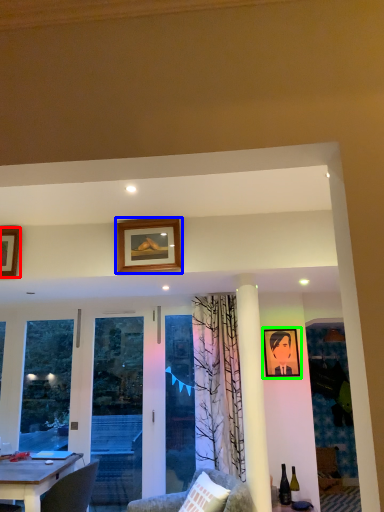
Question: Considering the real-world distances, which object is closest to picture frame (highlighted by a red box)? picture frame (highlighted by a blue box) or picture frame (highlighted by a green box).

Choices:
 (A) picture frame
 (B) picture frame

Answer: (A)